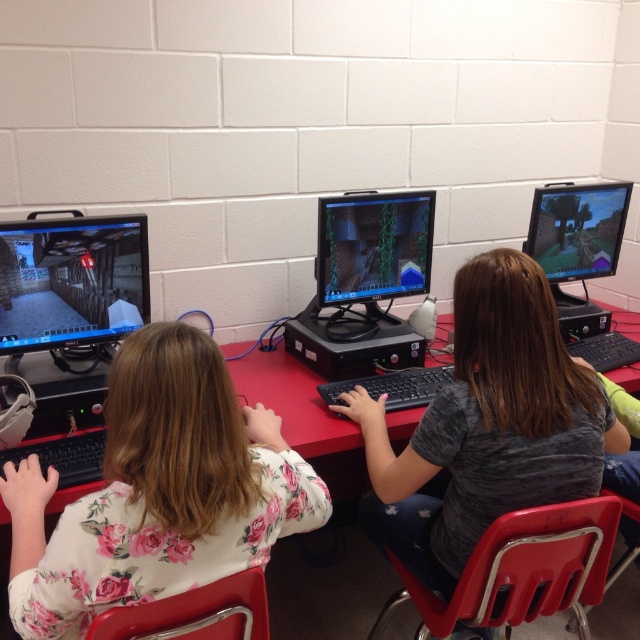
You are a teacher standing at the back of the classroom. You want to walk between the two students working on their computers. The path between the two matte black monitors is 1.75 meters wide. If your wheelchair has a width of 1.5 meters, can you safely navigate through the space between the two matte black monitor at left and matte black monitor at right?

The path between the matte black monitor at left and matte black monitor at right is 1.75 meters wide. Since your wheelchair is 1.5 meters wide, you can safely navigate through the space as there is enough clearance between the two monitors.

Where is the floral shirt at center located in the image?

The floral shirt at center is located at point (157, 492).

You are a teacher observing the classroom. You notice the floral shirt at center and the matte black monitor at right. Which object is positioned to the left of the other?

The floral shirt at center is to the left of the matte black monitor at right.